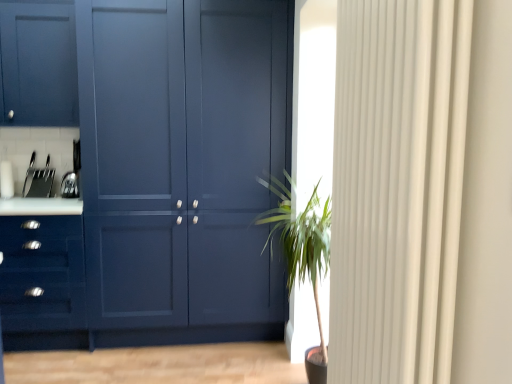
Question: Does green leafy plant at center have a greater width compared to matte blue cabinet at center?

Choices:
 (A) no
 (B) yes

Answer: (A)

Question: Considering the relative sizes of green leafy plant at center and matte blue cabinet at center in the image provided, is green leafy plant at center bigger than matte blue cabinet at center?

Choices:
 (A) yes
 (B) no

Answer: (B)

Question: Considering the relative positions of green leafy plant at center and matte blue cabinet at center in the image provided, is green leafy plant at center to the right of matte blue cabinet at center from the viewer's perspective?

Choices:
 (A) yes
 (B) no

Answer: (A)

Question: Is green leafy plant at center at the left side of matte blue cabinet at center?

Choices:
 (A) yes
 (B) no

Answer: (B)

Question: Does green leafy plant at center contain matte blue cabinet at center?

Choices:
 (A) yes
 (B) no

Answer: (B)

Question: Is green leafy plant at center facing away from matte blue cabinet at center?

Choices:
 (A) yes
 (B) no

Answer: (B)

Question: Is the depth of matte blue drawer at left greater than that of green leafy plant at center?

Choices:
 (A) no
 (B) yes

Answer: (B)

Question: Is matte blue drawer at left shorter than green leafy plant at center?

Choices:
 (A) yes
 (B) no

Answer: (A)

Question: From the image's perspective, is matte blue drawer at left above green leafy plant at center?

Choices:
 (A) no
 (B) yes

Answer: (A)

Question: Is matte blue drawer at left thinner than green leafy plant at center?

Choices:
 (A) yes
 (B) no

Answer: (B)

Question: Is matte blue drawer at left positioned beyond the bounds of green leafy plant at center?

Choices:
 (A) yes
 (B) no

Answer: (A)

Question: Is matte blue drawer at left far away from green leafy plant at center?

Choices:
 (A) no
 (B) yes

Answer: (B)

Question: From the image's perspective, would you say satin silver toaster at left is shown under matte blue drawer at left?

Choices:
 (A) no
 (B) yes

Answer: (A)